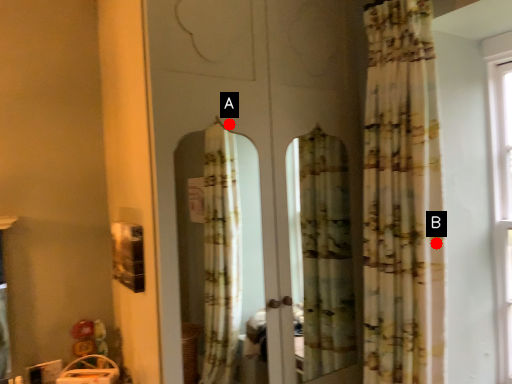
Question: Two points are circled on the image, labeled by A and B beside each circle. Among these points, which one is nearest to the camera?

Choices:
 (A) A is closer
 (B) B is closer

Answer: (A)